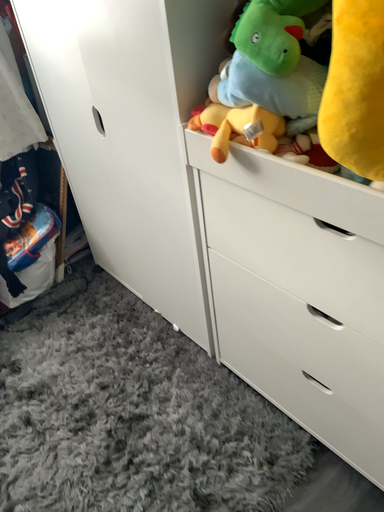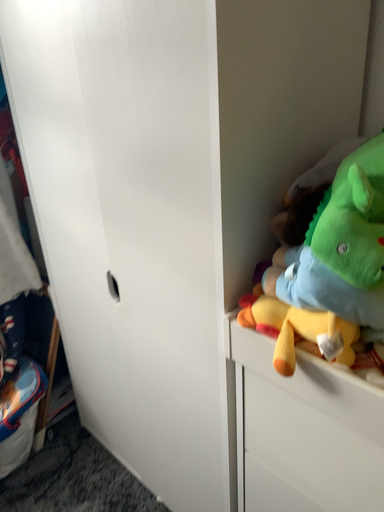
Question: How did the camera likely rotate when shooting the video?

Choices:
 (A) rotated upward
 (B) rotated downward

Answer: (A)